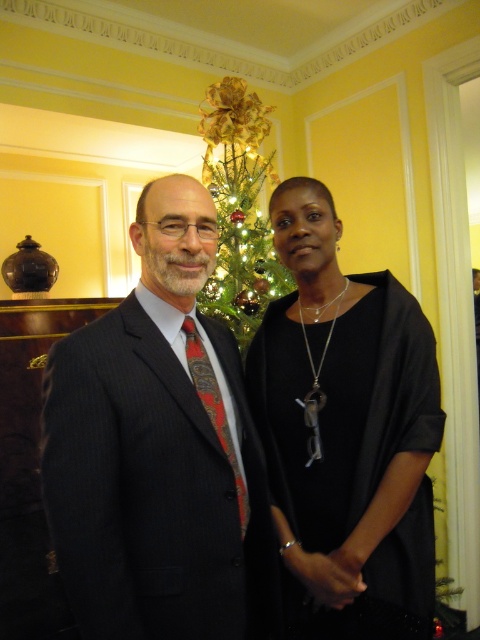
Question: Which point is closer to the camera?

Choices:
 (A) black matte dress at center
 (B) dark pinstripe suit at center

Answer: (B)

Question: Does black matte dress at center appear on the left side of paisley silk tie at center?

Choices:
 (A) yes
 (B) no

Answer: (B)

Question: Among these points, which one is farthest from the camera?

Choices:
 (A) (195, 371)
 (B) (80, 344)
 (C) (220, 147)

Answer: (C)

Question: Observing the image, what is the correct spatial positioning of black matte dress at center in reference to green shiny christmas tree at center?

Choices:
 (A) left
 (B) right

Answer: (B)

Question: Which point is farther to the camera?

Choices:
 (A) paisley silk tie at center
 (B) black matte dress at center
 (C) dark pinstripe suit at center

Answer: (B)

Question: Is dark pinstripe suit at center in front of black matte dress at center?

Choices:
 (A) no
 (B) yes

Answer: (B)